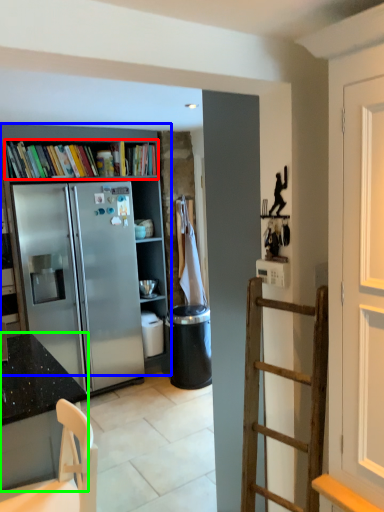
Question: Considering the real-world distances, which object is farthest from book (highlighted by a red box)? bookcase (highlighted by a blue box) or cabinetry (highlighted by a green box)?

Choices:
 (A) bookcase
 (B) cabinetry

Answer: (B)